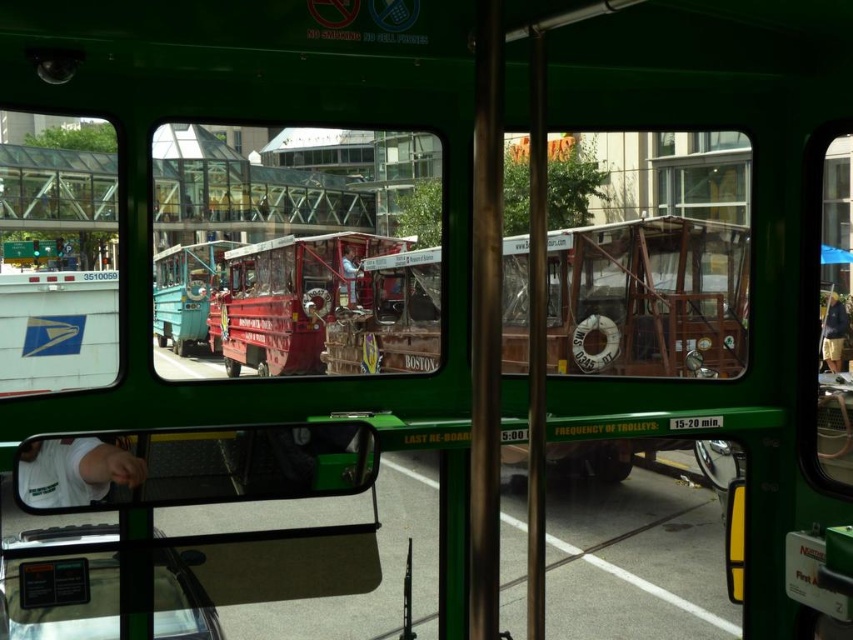
Question: Is rusty wood decker bus at center thinner than shiny red trolley at center?

Choices:
 (A) no
 (B) yes

Answer: (A)

Question: Where is rusty wood decker bus at center located in relation to shiny red trolley at center in the image?

Choices:
 (A) above
 (B) below

Answer: (B)

Question: Does rusty wood decker bus at center appear under shiny red trolley at center?

Choices:
 (A) yes
 (B) no

Answer: (A)